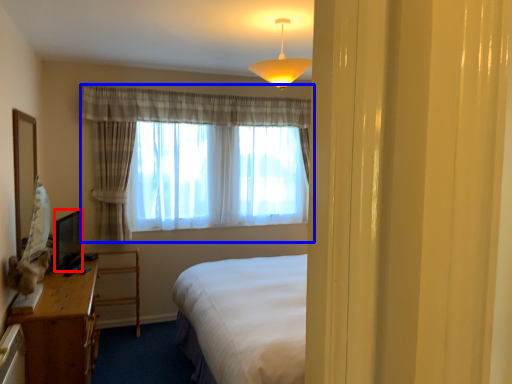
Question: Which point is further to the camera, television (highlighted by a red box) or curtain (highlighted by a blue box)?

Choices:
 (A) television
 (B) curtain

Answer: (B)